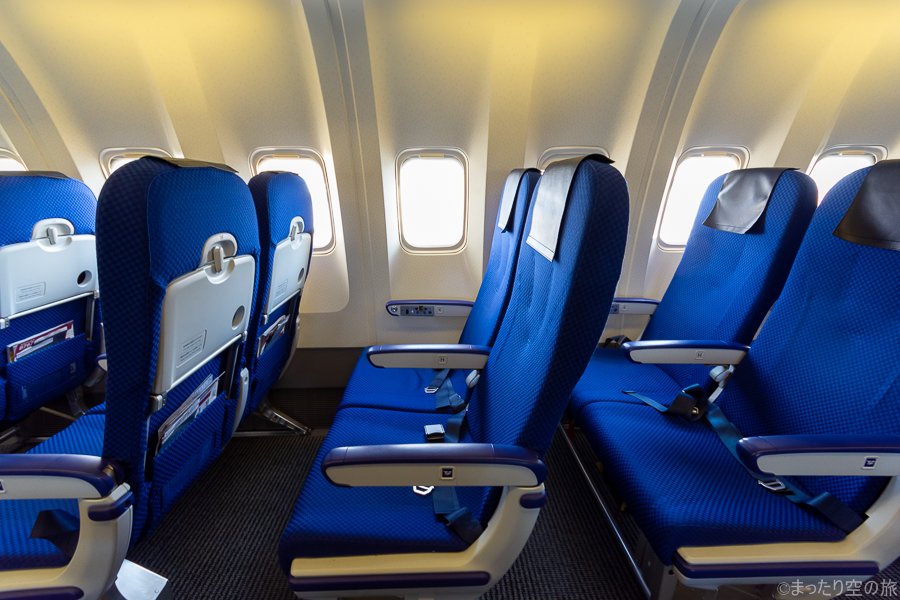
This screenshot has width=900, height=600. I want to click on window, so click(x=10, y=161), click(x=117, y=162), click(x=286, y=162), click(x=426, y=182), click(x=544, y=170), click(x=690, y=178), click(x=840, y=167).